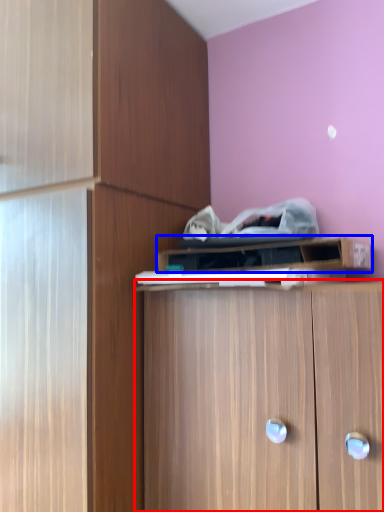
Question: Which of the following is the closest to the observer, cabinetry (highlighted by a red box) or cabinetry (highlighted by a blue box)?

Choices:
 (A) cabinetry
 (B) cabinetry

Answer: (A)